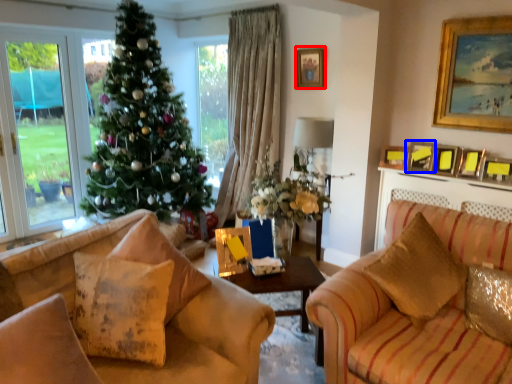
Question: Which object is closer to the camera taking this photo, picture frame (highlighted by a red box) or picture frame (highlighted by a blue box)?

Choices:
 (A) picture frame
 (B) picture frame

Answer: (B)